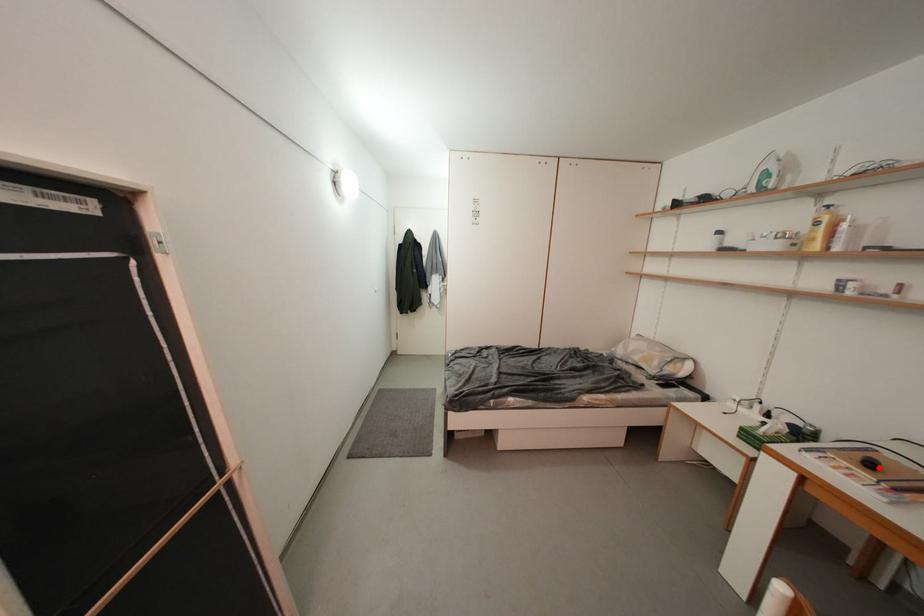
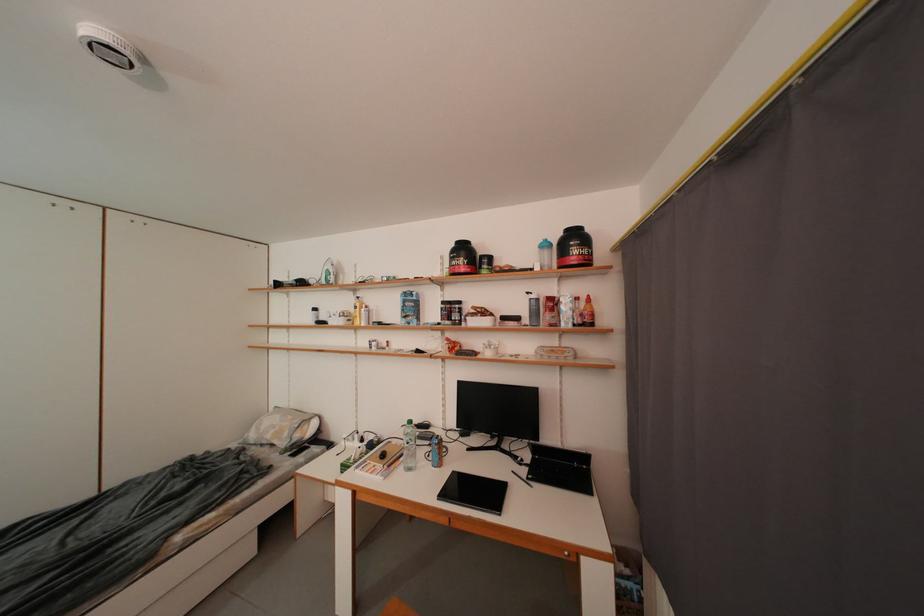
The point at the highlighted location is marked in the first image. Where is the corresponding point in the second image?

(391, 459)